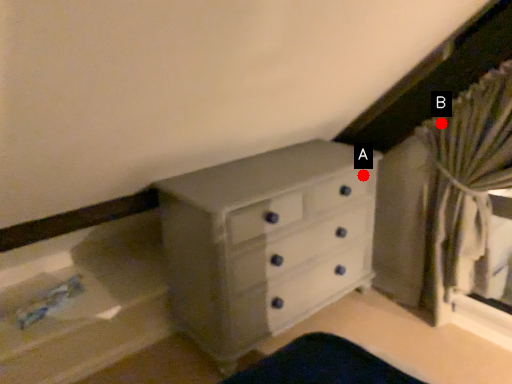
Question: Two points are circled on the image, labeled by A and B beside each circle. Which point is further to the camera?

Choices:
 (A) A is further
 (B) B is further

Answer: (A)